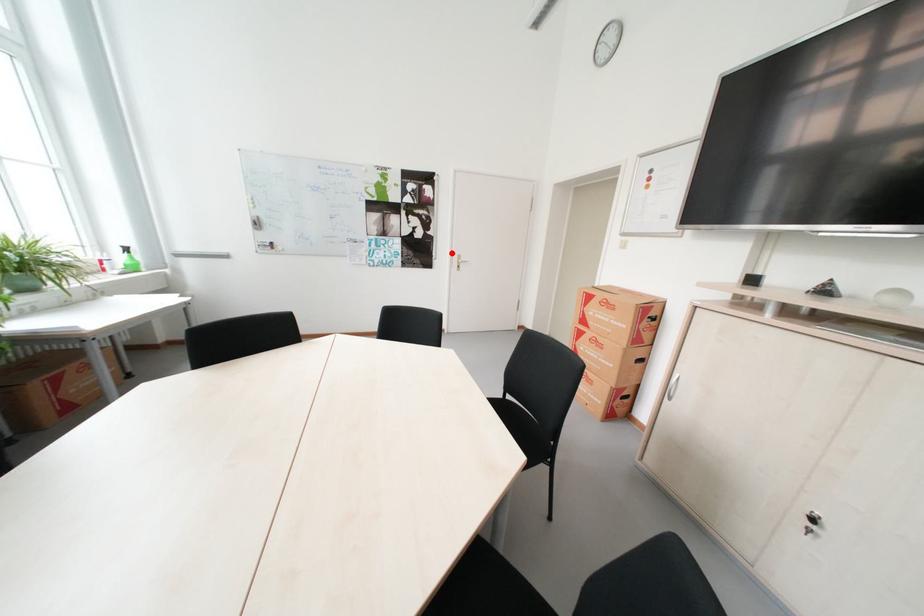
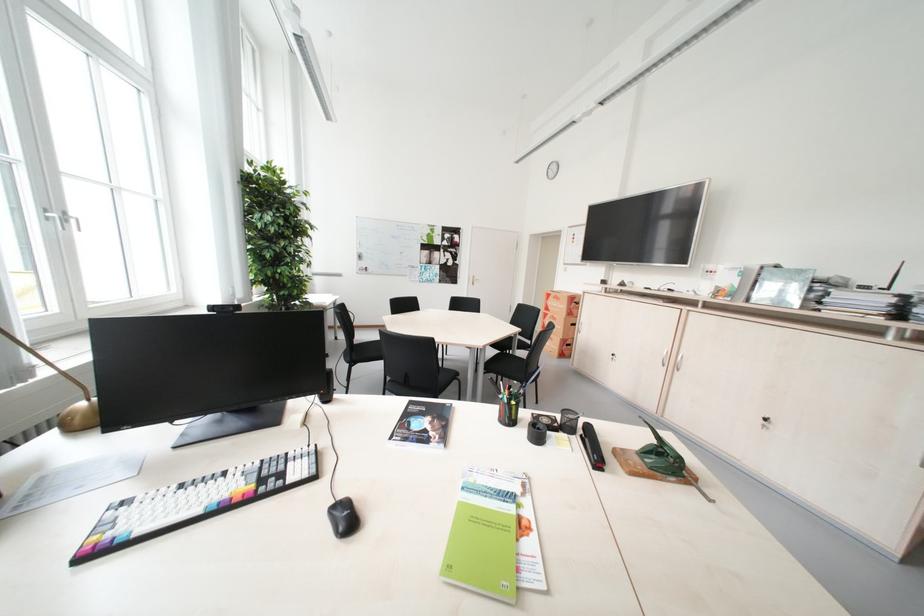
Find the pixel in the second image that matches the highlighted location in the first image.

(473, 275)